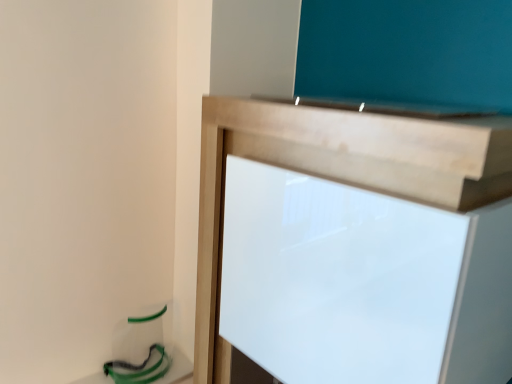
Question: Should I look upward or downward to see white glossy board at center?

Choices:
 (A) up
 (B) down

Answer: (B)